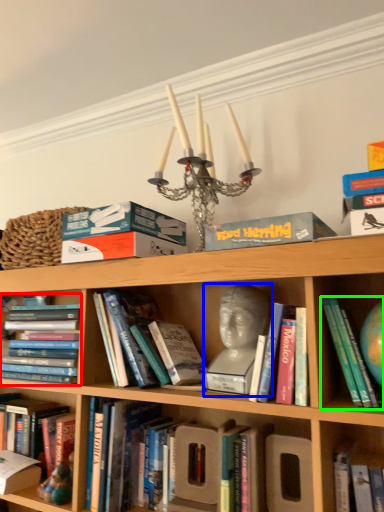
Question: Which is nearer to the book (highlighted by a red box)? person (highlighted by a blue box) or book (highlighted by a green box).

Choices:
 (A) person
 (B) book

Answer: (A)